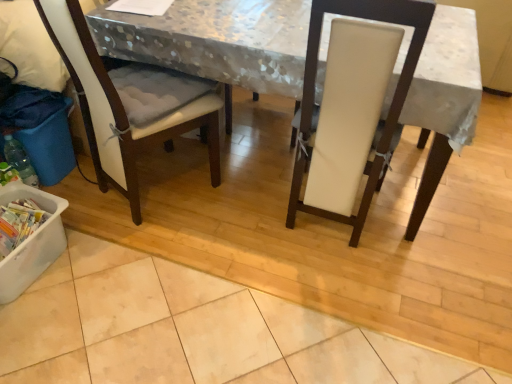
Question: Relative to translucent plastic bottle at lower left, is white plastic container at lower left, placed as the 2th recycling bin when sorted from top to bottom, in front or behind?

Choices:
 (A) front
 (B) behind

Answer: (A)

Question: Considering the positions of white plastic container at lower left, placed as the 2th recycling bin when sorted from top to bottom, and translucent plastic bottle at lower left in the image, is white plastic container at lower left, placed as the 2th recycling bin when sorted from top to bottom, taller or shorter than translucent plastic bottle at lower left?

Choices:
 (A) short
 (B) tall

Answer: (A)

Question: Which object is the closest to the white leather chair at center, the second chair when ordered from left to right?

Choices:
 (A) white plastic container at lower left, marked as the first recycling bin in a bottom-to-top arrangement
 (B) blue plastic recycling bin at lower left, which ranks as the second recycling bin in bottom-to-top order
 (C) translucent plastic bottle at lower left
 (D) white fabric-covered table at center
 (E) white fabric chair at left, the second chair positioned from the right

Answer: (D)

Question: Considering the real-world distances, which object is farthest from the white fabric chair at left, the 1th chair in the left-to-right sequence?

Choices:
 (A) white leather chair at center, the second chair when ordered from left to right
 (B) white fabric-covered table at center
 (C) blue plastic recycling bin at lower left, which ranks as the second recycling bin in bottom-to-top order
 (D) white plastic container at lower left, placed as the 2th recycling bin when sorted from top to bottom
 (E) white fabric cushion at left

Answer: (A)